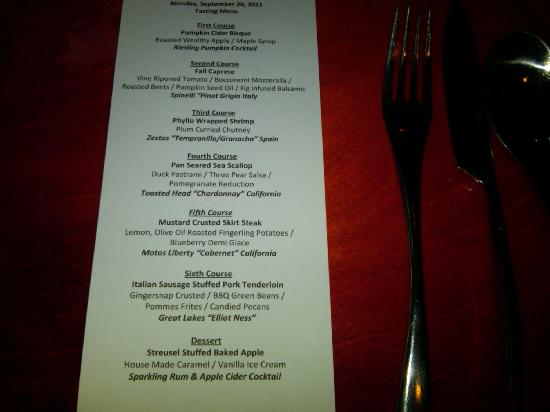
Where is `metal spoon`? Image resolution: width=550 pixels, height=412 pixels. metal spoon is located at coordinates [522, 124].